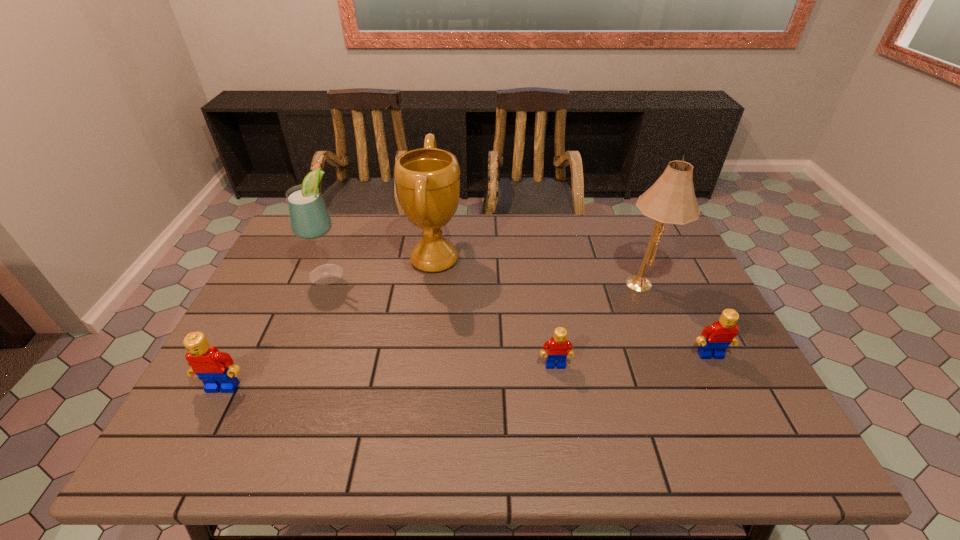
Please determine a free point for an extra Lego to ensure balance. Please provide its 2D coordinates. Your answer should be formatted as a tuple, i.e. [(x, y)], where the tuple contains the x and y coordinates of a point satisfying the conditions above.

[(393, 376)]